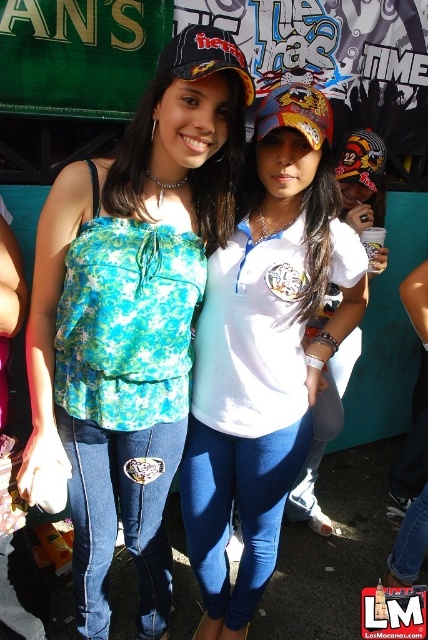
Is floral fabric top at center to the right of black matte baseball cap at center from the viewer's perspective?

No, floral fabric top at center is not to the right of black matte baseball cap at center.

Who is more forward, (199, 180) or (190, 54)?

Positioned in front is point (190, 54).

This screenshot has height=640, width=428. What are the coordinates of `floral fabric top at center` in the screenshot? It's located at (130, 317).

From the picture: Which is above, floral fabric top at center or white matte shirt at center?

Positioned higher is floral fabric top at center.

Who is positioned more to the left, floral fabric top at center or white matte shirt at center?

floral fabric top at center

The height and width of the screenshot is (640, 428). Identify the location of floral fabric top at center. (130, 317).

In the scene shown: Who is shorter, white matte shirt at center or black matte baseball cap at center?

black matte baseball cap at center

At what (x,y) coordinates should I click in order to perform the action: click on white matte shirt at center. Please return your answer as a coordinate pair (x, y). Looking at the image, I should click on (264, 353).

Does point (265, 403) lie behind point (214, 52)?

Yes.

Locate an element on the screen. The width and height of the screenshot is (428, 640). white matte shirt at center is located at coordinates (264, 353).